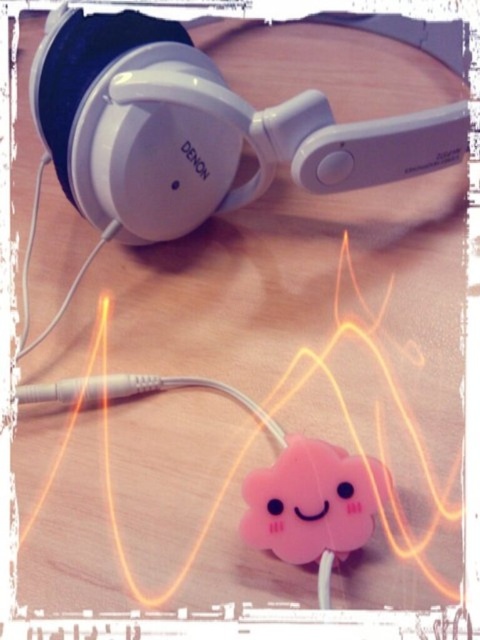
In the scene shown: You are organizing a desk and need to place a new item between the white matte headphones at upper center and the pink matte cloud at center. Which object should you place the new item closer to so it doesn

The new item should be placed closer to the pink matte cloud at center because the white matte headphones at upper center are closer to you, so the pink matte cloud at center is farther away and requires more space between them.

You are standing 4 feet away from a desk with the white matte headphones at upper center. Can you comfortably reach them without moving your feet?

The white matte headphones at upper center are 3.89 feet away from the viewer. Since you are standing 4 feet away, you can comfortably reach them without moving your feet as the distance is just slightly less than your current position.